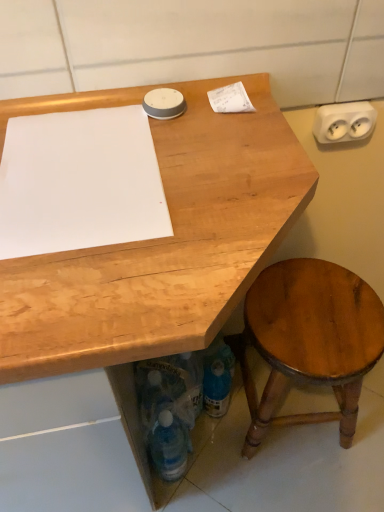
I want to click on vacant space underneath white paper at upper left, arranged as the first notepad when ordered from the bottom (from a real-world perspective), so click(84, 170).